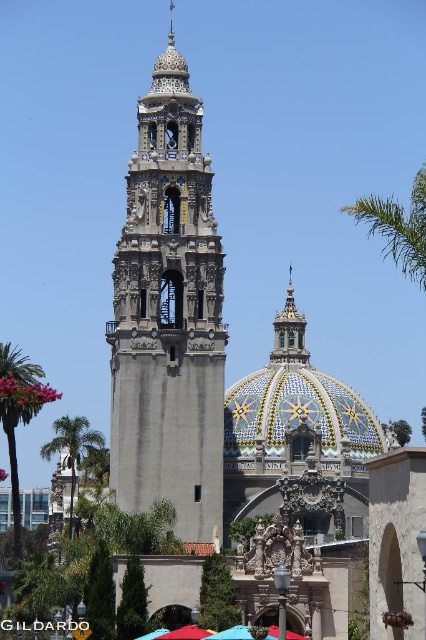
You are a tourist standing in front of the tower and want to take a photo that includes both green leafy palm tree at upper right and green leafy palm tree at lower left. Which palm tree should you focus on to ensure both are in the frame?

You should focus on the green leafy palm tree at lower left because it is shorter than the green leafy palm tree at upper right, allowing both to fit within the frame when positioned appropriately.

You are a tourist standing in front of the tower and want to take a photo that includes both the multicolored mosaic dome at center and the green leafy palm tree at upper right. Which object should be placed closer to the camera to ensure both fit in the frame?

The multicolored mosaic dome at center is smaller in size compared to the green leafy palm tree at upper right, so to ensure both fit in the frame, the palm tree should be closer to the camera since larger objects need to be nearer to maintain balance in the photo.

You are an architect analyzing the image. You need to determine which structure is taller between the matte gray stone bell tower at center and the multicolored mosaic dome at center. Based on the scene, which one is taller?

The matte gray stone bell tower at center is taller than the multicolored mosaic dome at center according to the description.